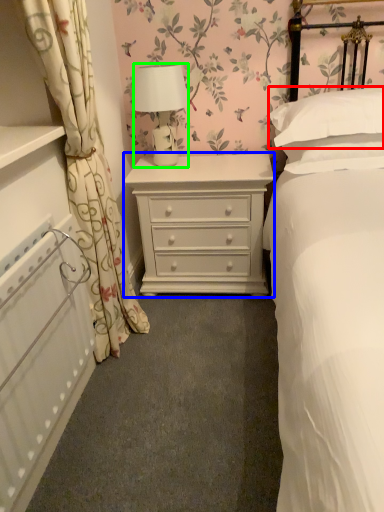
Question: Based on their relative distances, which object is farther from pillow (highlighted by a red box)? Choose from chest of drawers (highlighted by a blue box) and lamp (highlighted by a green box).

Choices:
 (A) chest of drawers
 (B) lamp

Answer: (B)